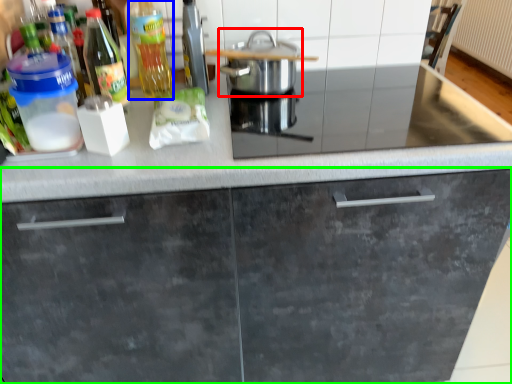
Question: Considering the real-world distances, which object is closest to home appliance (highlighted by a red box)? bottle (highlighted by a blue box) or cabinetry (highlighted by a green box).

Choices:
 (A) bottle
 (B) cabinetry

Answer: (A)